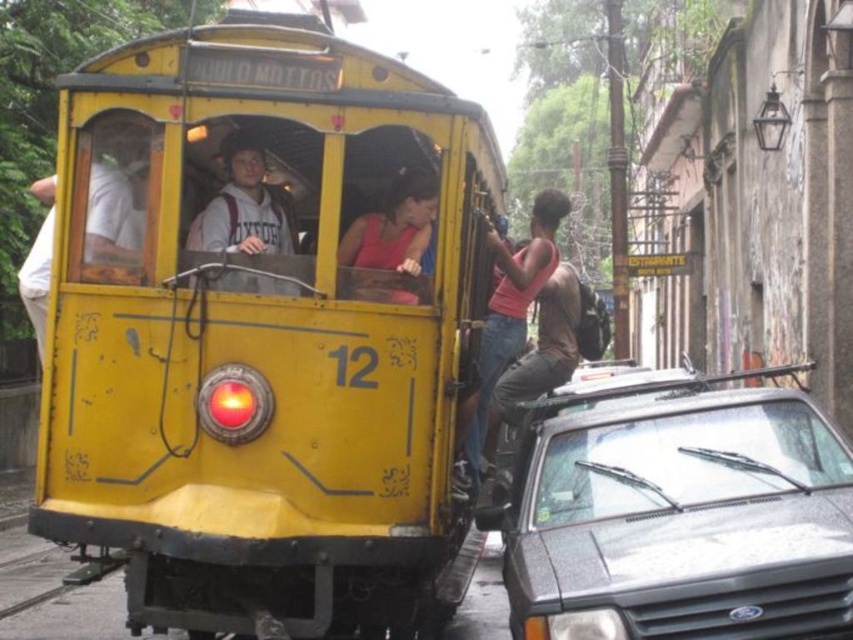
You are a photographer trying to capture a closeup shot of both the matte gray hoodie at center and the matte pink tank top at center in the scene. Given that your camera has a maximum focus range of 30 inches, will you be able to capture both subjects in focus without moving the camera?

The matte gray hoodie at center and the matte pink tank top at center are 28.93 inches apart from each other, which is within the camera maximum focus range of 30 inches. Therefore, you can capture both subjects in focus without moving the camera.

You are a pedestrian standing on the sidewalk. You see a yellow matte school bus at center and a matte gray hoodie at center. Which object is closer to the ground?

The yellow matte school bus at center is closer to the ground because it is below the matte gray hoodie at center.